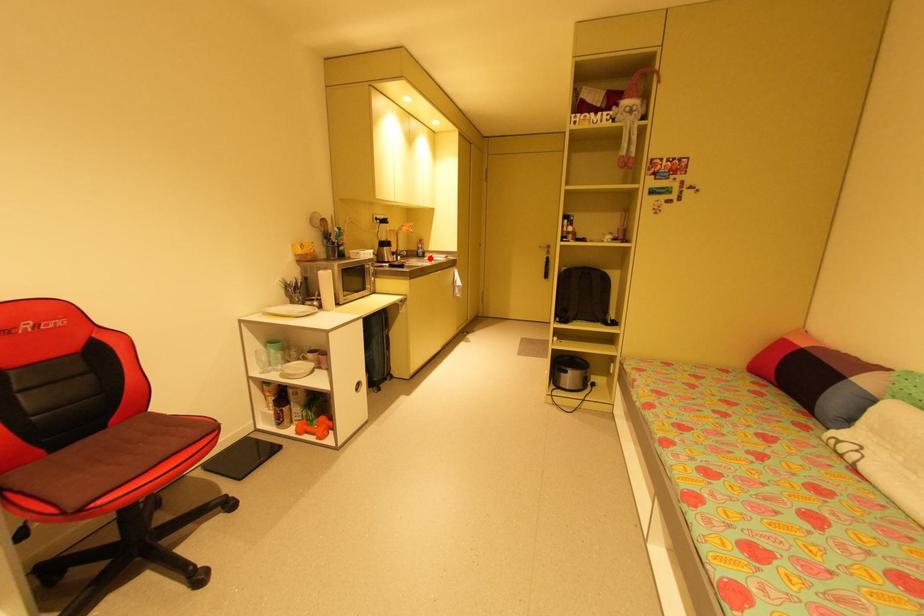
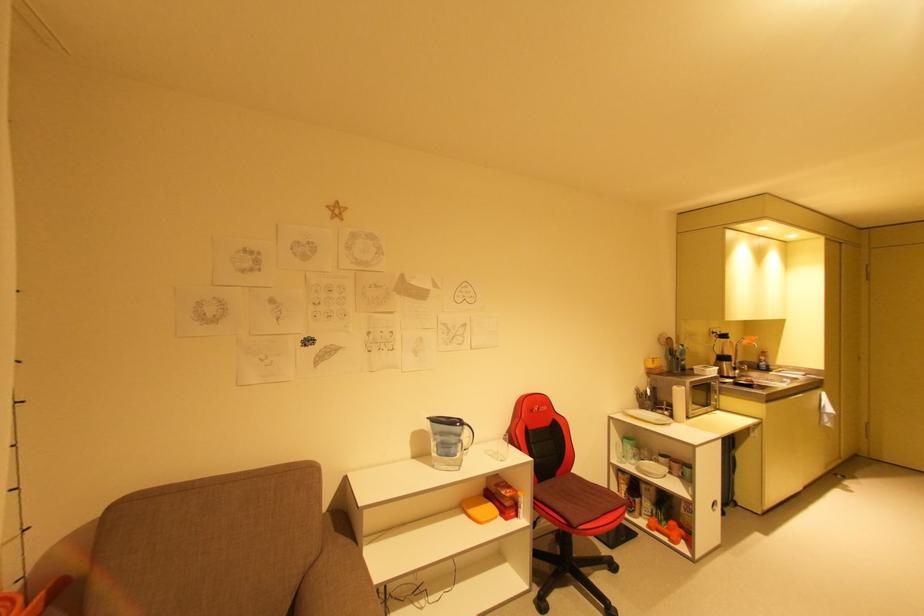
Where in the second image is the point corresponding to the highlighted location from the first image?

(776, 373)